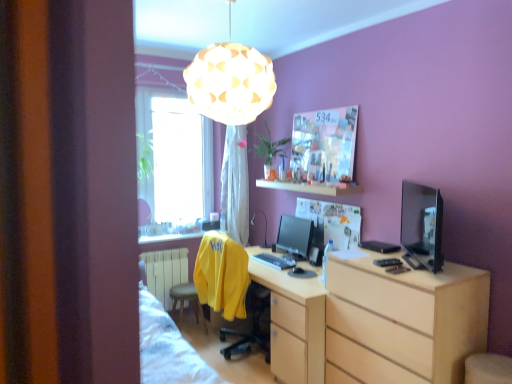
Question: Is yellow fabric swivel chair at center wider than satin black monitor at center, which appears as the first computer monitor when viewed from the left?

Choices:
 (A) no
 (B) yes

Answer: (B)

Question: From a real-world perspective, is yellow fabric swivel chair at center under satin black monitor at center, which is the 2th computer monitor from right to left?

Choices:
 (A) yes
 (B) no

Answer: (A)

Question: Are yellow fabric swivel chair at center and satin black monitor at center, the 1th computer monitor viewed from the back, beside each other?

Choices:
 (A) no
 (B) yes

Answer: (A)

Question: From the image's perspective, is yellow fabric swivel chair at center located beneath satin black monitor at center, which appears as the first computer monitor when viewed from the left?

Choices:
 (A) yes
 (B) no

Answer: (A)

Question: Does yellow fabric swivel chair at center have a larger size compared to satin black monitor at center, which is the 2th computer monitor from right to left?

Choices:
 (A) yes
 (B) no

Answer: (A)

Question: Is yellow fabric swivel chair at center not within satin black monitor at center, the 1th computer monitor viewed from the back?

Choices:
 (A) no
 (B) yes

Answer: (B)

Question: Would you say white glossy shelf at upper center is a long distance from matte black desk lamp at center?

Choices:
 (A) no
 (B) yes

Answer: (A)

Question: Can you confirm if white glossy shelf at upper center is bigger than matte black desk lamp at center?

Choices:
 (A) no
 (B) yes

Answer: (A)

Question: Is white glossy shelf at upper center positioned in front of matte black desk lamp at center?

Choices:
 (A) yes
 (B) no

Answer: (A)

Question: Does white glossy shelf at upper center have a smaller size compared to matte black desk lamp at center?

Choices:
 (A) yes
 (B) no

Answer: (A)

Question: Is white glossy shelf at upper center positioned behind matte black desk lamp at center?

Choices:
 (A) yes
 (B) no

Answer: (B)

Question: Does white glossy shelf at upper center have a lesser height compared to matte black desk lamp at center?

Choices:
 (A) yes
 (B) no

Answer: (A)